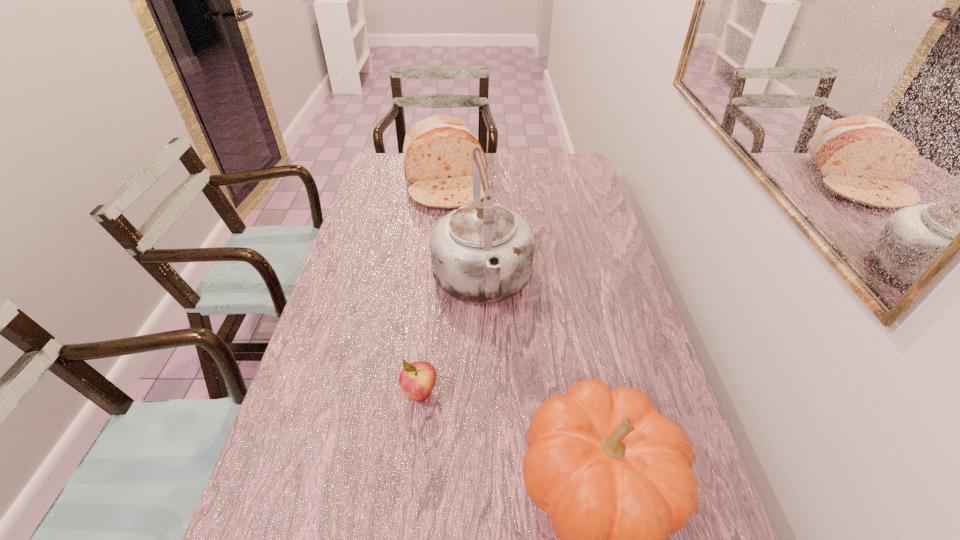
Find the location of a particular element. This screenshot has width=960, height=540. vacant space that's between the apple and the bread is located at coordinates (433, 288).

Find the location of a particular element. object that is the second closest to the tallest object is located at coordinates (437, 152).

This screenshot has height=540, width=960. Identify the location of object that is the second closest to the farthest object. (417, 379).

Image resolution: width=960 pixels, height=540 pixels. Identify the location of vacant area that satisfies the following two spatial constraints: 1. on the back side of the bread; 2. on the left side of the third farthest object. (444, 182).